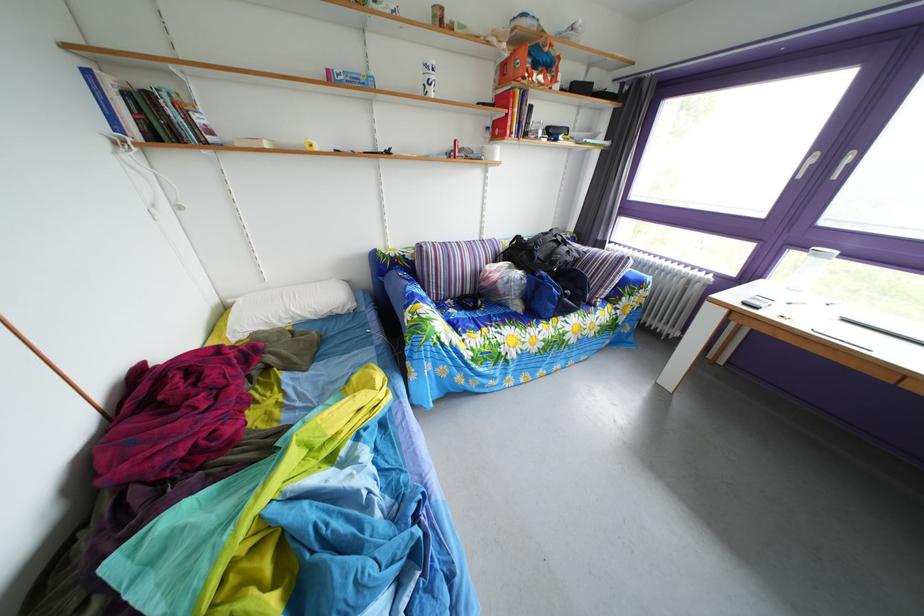
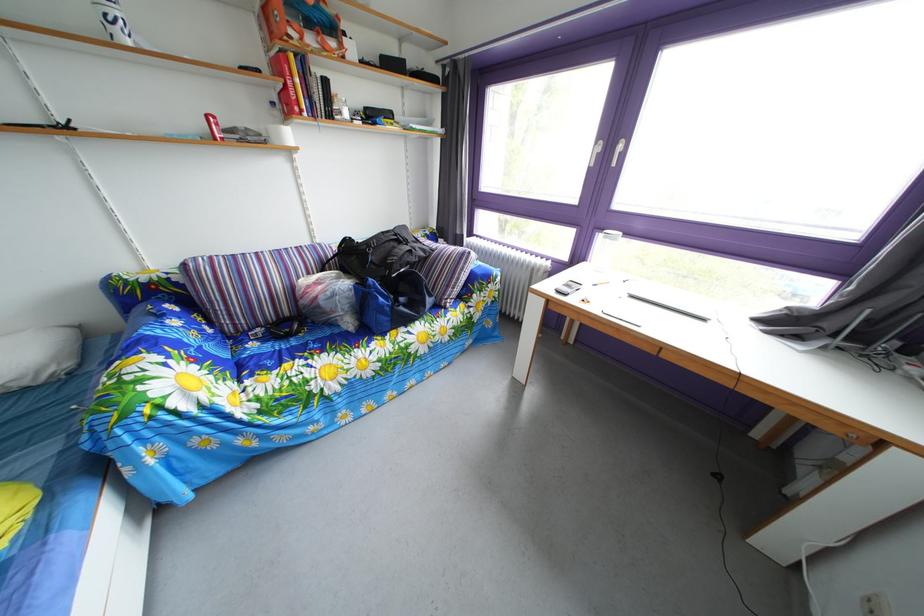
The point at (545, 74) is marked in the first image. Where is the corresponding point in the second image?

(320, 33)